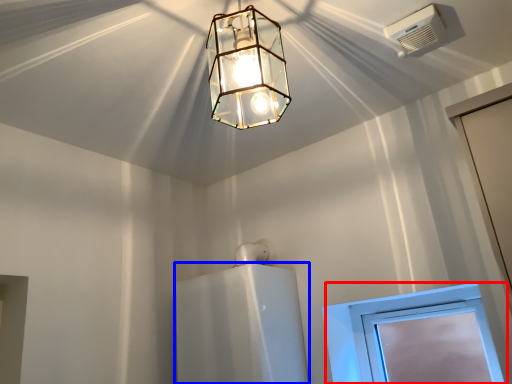
Question: Among these objects, which one is farthest to the camera, window (highlighted by a red box) or appliance (highlighted by a blue box)?

Choices:
 (A) window
 (B) appliance

Answer: (A)